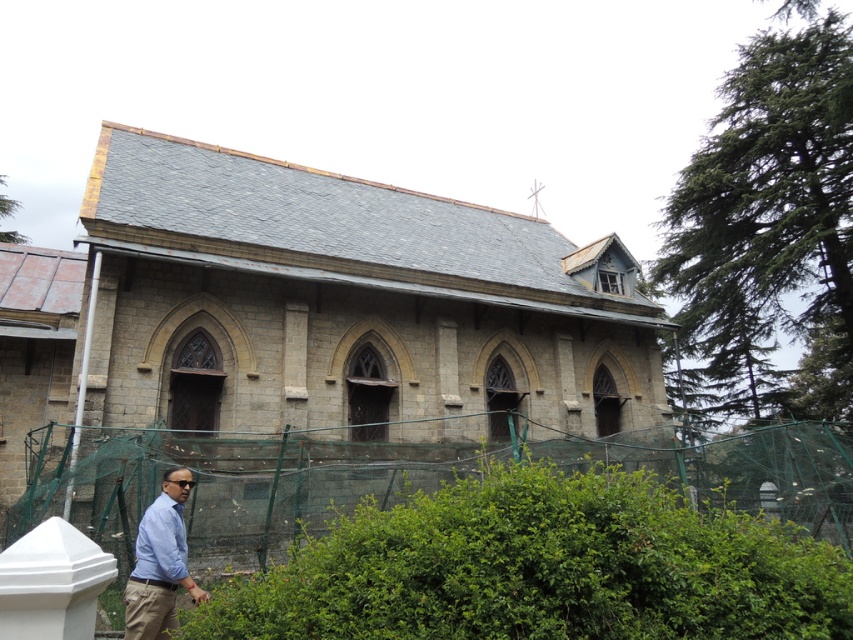
You are standing in front of the church and want to take a photo that includes both the church and the green leafy hedge at lower left. Where should you position yourself to ensure both are in the frame?

To include both the church and the green leafy hedge at lower left in your photo, position yourself so that the green leafy hedge at lower left is near the lower left corner of the frame, corresponding to its 2D location at point approximately 0.886 on the x and 0.637 on the y axis. This ensures the hedge is within the frame while the church occupies the central area.

You are standing in front of the church and want to take a photo that includes both the church and the green leafy hedge at lower left. If your camera has a maximum focus range of 10 feet, will you need to adjust your position to ensure both are in focus?

The green leafy hedge at lower left is 11.14 feet away from the camera, which exceeds the camera maximum focus range of 10 feet. Therefore, you need to move closer to ensure both the church and the hedge are within the focus range.

You are a visitor standing in front of the church and want to take a photo of the green leafy hedge at lower left and the light blue shirt at lower left. Which object should you zoom in on to capture more details of its texture?

The green leafy hedge at lower left has a larger size compared to the light blue shirt at lower left, so you should zoom in on the light blue shirt at lower left to capture more details of its texture.